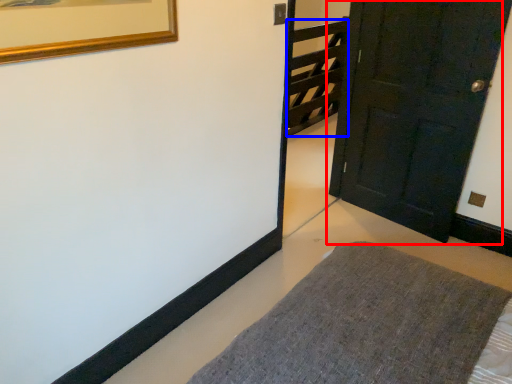
Question: Which object appears closest to the camera in this image, door (highlighted by a red box) or stairwell (highlighted by a blue box)?

Choices:
 (A) door
 (B) stairwell

Answer: (A)